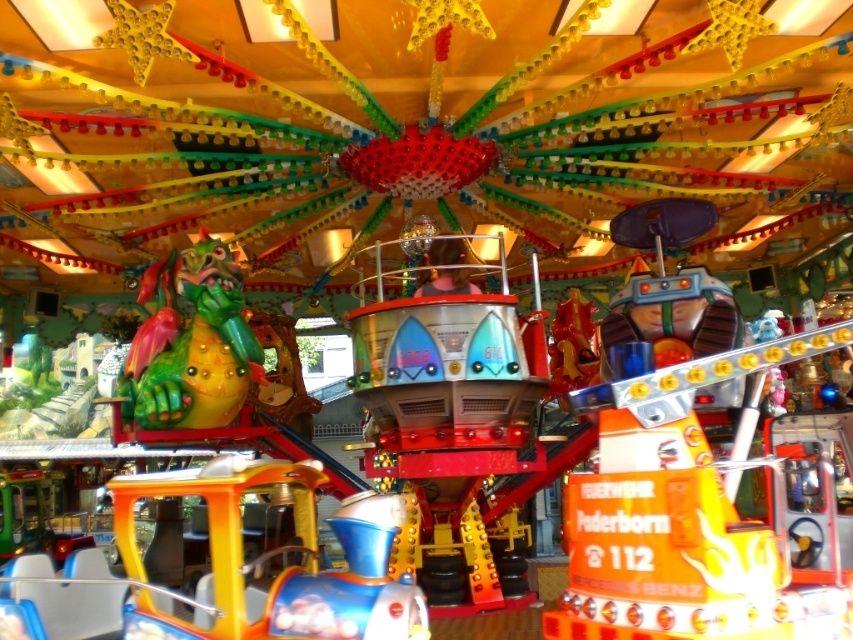
Question: Which of the following is the closest to the observer?

Choices:
 (A) (396, 397)
 (B) (146, 381)

Answer: (A)

Question: Among these objects, which one is nearest to the camera?

Choices:
 (A) green matte dragon at center
 (B) metallic blue spaceship at center

Answer: (B)

Question: Can you confirm if metallic blue spaceship at center is wider than green matte dragon at center?

Choices:
 (A) no
 (B) yes

Answer: (B)

Question: Which of the following is the farthest from the observer?

Choices:
 (A) (138, 413)
 (B) (492, 332)

Answer: (A)

Question: Is metallic blue spaceship at center smaller than green matte dragon at center?

Choices:
 (A) no
 (B) yes

Answer: (A)

Question: Can you confirm if metallic blue spaceship at center is smaller than green matte dragon at center?

Choices:
 (A) yes
 (B) no

Answer: (B)